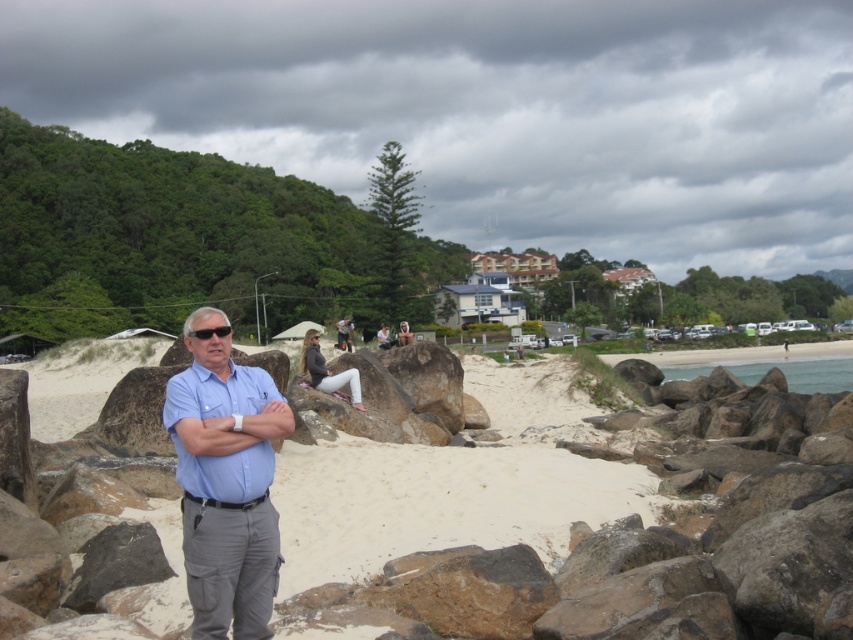
Question: Based on their relative distances, which object is nearer to the black plastic sunglasses at center?

Choices:
 (A) blue cotton shirt at center
 (B) smooth sand beach at center

Answer: (A)

Question: Can you confirm if smooth sand beach at center is smaller than black plastic sunglasses at center?

Choices:
 (A) yes
 (B) no

Answer: (B)

Question: Which object is the farthest from the smooth sand beach at center?

Choices:
 (A) light blue shirt at center
 (B) black plastic sunglasses at center

Answer: (A)

Question: Can you confirm if blue cotton shirt at center is wider than light blue shirt at center?

Choices:
 (A) yes
 (B) no

Answer: (B)

Question: Is white matte pants at center above light blue shirt at center?

Choices:
 (A) no
 (B) yes

Answer: (A)

Question: Which of the following is the farthest from the observer?

Choices:
 (A) smooth sand beach at center
 (B) black plastic sunglasses at center
 (C) white matte pants at center
 (D) light blue shirt at center

Answer: (D)